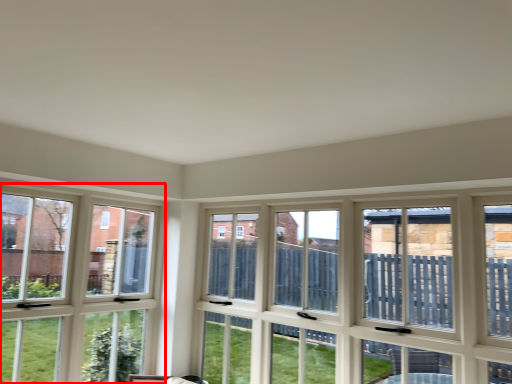
Question: In this image, where is window (annotated by the red box) located relative to window?

Choices:
 (A) right
 (B) left

Answer: (B)